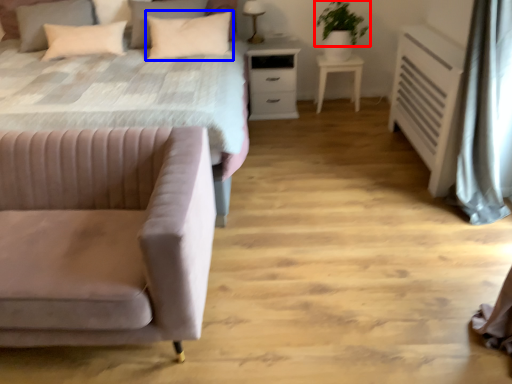
Question: Which of the following is the farthest to the observer, plant (highlighted by a red box) or pillow (highlighted by a blue box)?

Choices:
 (A) plant
 (B) pillow

Answer: (A)